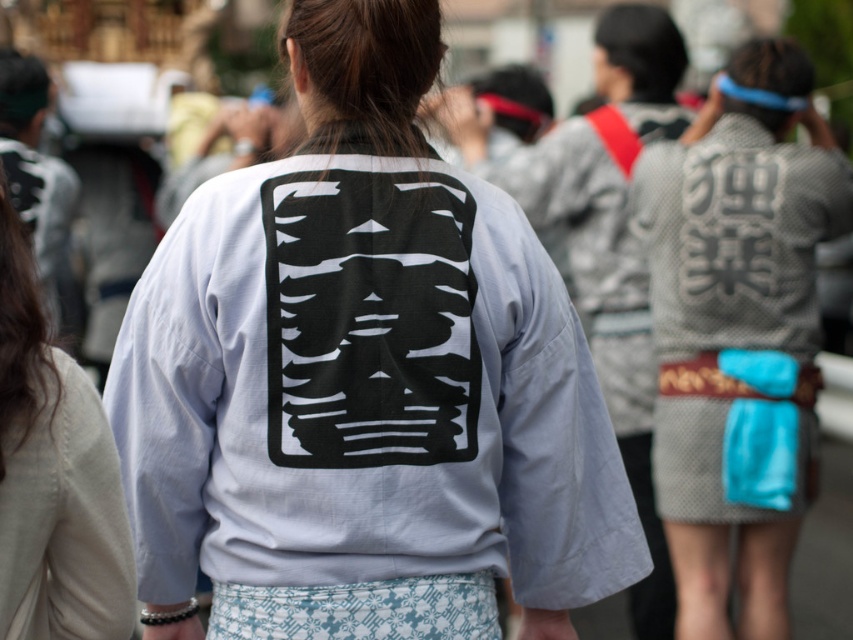
You are standing at the origin point of the coordinate system. You see two points in the image, point (695,228) and point (15,404). Which point is located further away from you?

Point (695,228) is behind point (15,404), so it is further away from you.

You are standing in a traditional Japanese event and see two kimonos at center. Which kimono is closer to you, the white textured kimono at center or the light gray cotton kimono at center?

The white textured kimono at center is closer to you because it is further to the viewer than the light gray cotton kimono at center.

You are a photographer trying to capture the person wearing the white cotton kimono at center and the light gray cotton kimono at center. Since both are at the center, how can you determine which one is in front?

The white cotton kimono at center is positioned over the light gray cotton kimono at center, so the white one is in front.